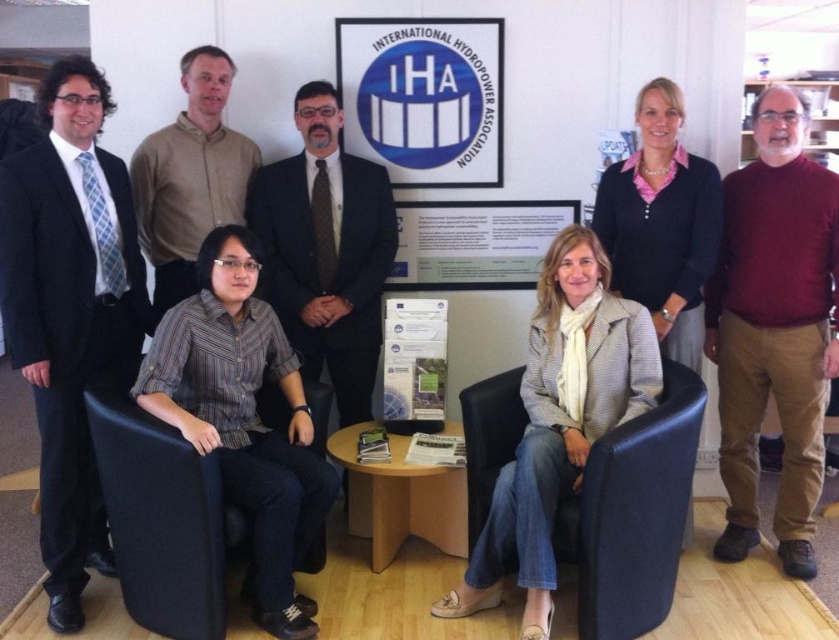
Question: Is maroon sweater at right smaller than dark brown suit at center?

Choices:
 (A) yes
 (B) no

Answer: (B)

Question: Which object is farther from the camera taking this photo?

Choices:
 (A) brown shirt at upper center
 (B) white paper at center
 (C) maroon sweater at right
 (D) matte black suit at left

Answer: (B)

Question: Among these objects, which one is nearest to the camera?

Choices:
 (A) black fabric armchair at lower left
 (B) brown shirt at upper center
 (C) dark brown suit at center
 (D) matte black suit at left

Answer: (A)

Question: Does black fabric armchair at lower left appear on the right side of brown shirt at upper center?

Choices:
 (A) no
 (B) yes

Answer: (B)

Question: Can you confirm if matte black suit at left is bigger than white paper at center?

Choices:
 (A) yes
 (B) no

Answer: (A)

Question: Based on their relative distances, which object is nearer to the black fabric armchair at lower left?

Choices:
 (A) brown shirt at upper center
 (B) white paper at center
 (C) black leather armchair at lower center
 (D) dark brown suit at center

Answer: (D)